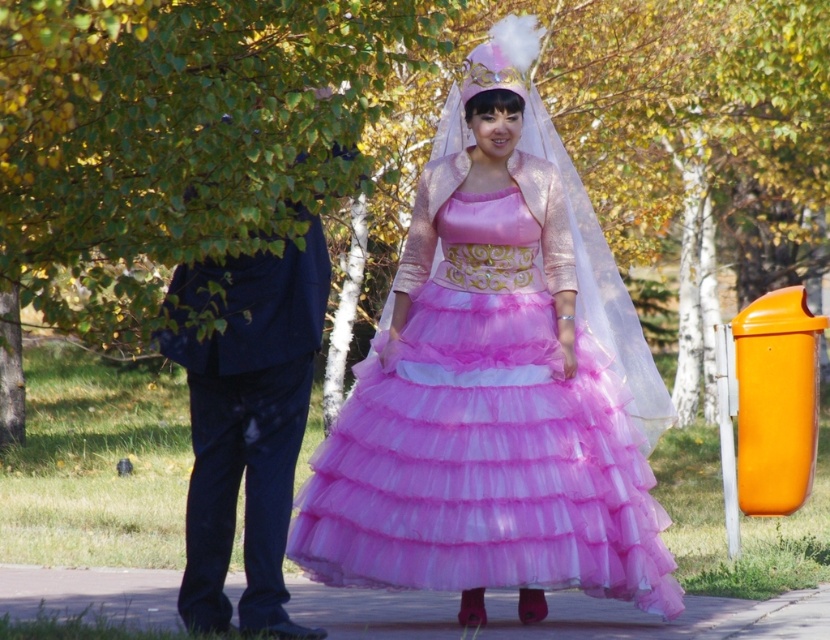
You are a photographer standing at the edge of a stage. You want to capture a full body shot of the matte pink tulle dress at center. The camera you are using has a minimum focusing distance of 8 meters. Can you take the photo without moving closer?

The distance between you and the matte pink tulle dress at center is 9.23 meters, which is greater than the camera minimum focusing distance of 8 meters. Therefore, you can take the photo without moving closer.

You are attending a royal ball and see the matte pink tulle dress at center and the dark blue suit at left. Which one is positioned higher in the image?

The matte pink tulle dress at center is located above the dark blue suit at left, so it is positioned higher in the image.

You are a photographer setting up a backdrop for a photoshoot. The backdrop is 1.8 meters wide. You need to position the matte pink tulle dress at center and the dark blue suit at left so that both fit within the backdrop without overlapping. Based on their widths, can both items fit side by side on the backdrop?

The matte pink tulle dress at center might be wider than the dark blue suit at left. If the dress is indeed wider, the combined width of both items could exceed the backdrop width of 1.8 meters, making it difficult to fit them side by side without overlapping. However, if the dress is not significantly wider, they might fit. More information about their exact widths is needed to determine this conclusively.